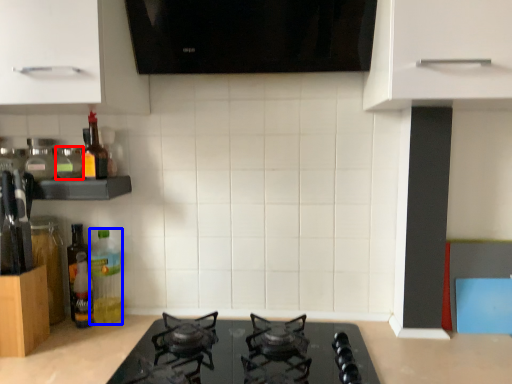
Question: Which point is further to the camera, bottle (highlighted by a red box) or bottle (highlighted by a blue box)?

Choices:
 (A) bottle
 (B) bottle

Answer: (B)